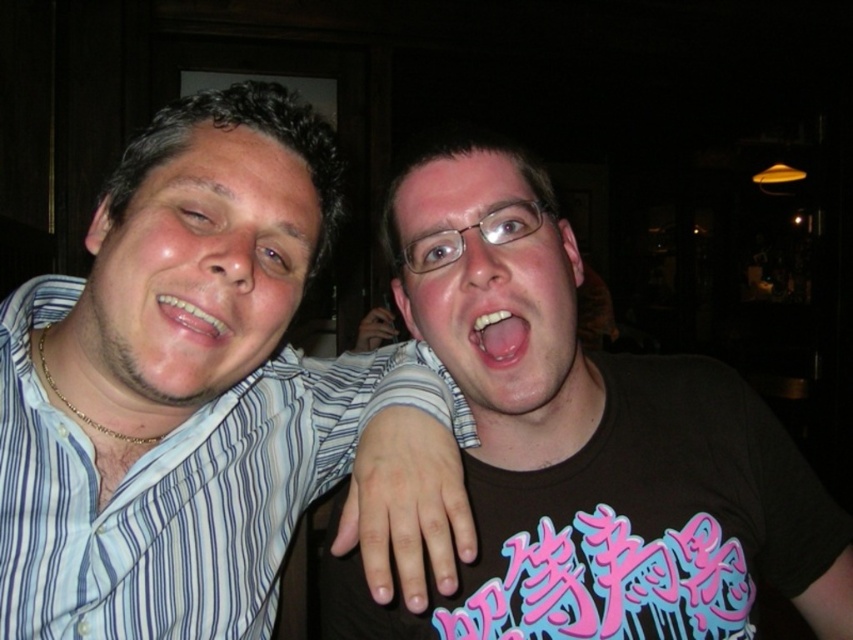
Is point (525, 202) behind point (509, 364)?

Yes, point (525, 202) is behind point (509, 364).

Locate an element on the screen. The height and width of the screenshot is (640, 853). black matte t-shirt at center is located at coordinates (587, 445).

The height and width of the screenshot is (640, 853). What are the coordinates of `black matte t-shirt at center` in the screenshot? It's located at (587, 445).

Who is more forward, (451,412) or (495,406)?

Point (495,406)

Between blue striped shirt at left and matte black face at center, which one is positioned lower?

blue striped shirt at left

Is point (241, 611) less distant than point (519, 412)?

No, it is not.

Locate an element on the screen. The width and height of the screenshot is (853, 640). blue striped shirt at left is located at coordinates (180, 486).

Which is behind, point (802, 490) or point (167, 304)?

Positioned behind is point (802, 490).

Is black matte t-shirt at center further to camera compared to glossy white teeth at center?

Yes, black matte t-shirt at center is behind glossy white teeth at center.

What are the coordinates of `black matte t-shirt at center` in the screenshot? It's located at (587, 445).